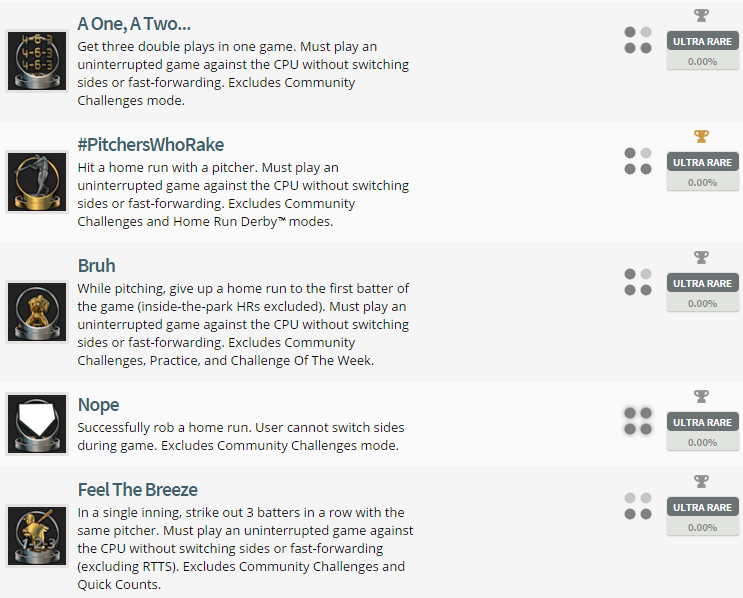
In order to click on trophies in this screenshot , I will do 700,14, 709,137, 697,255, 697,396, 707,483.